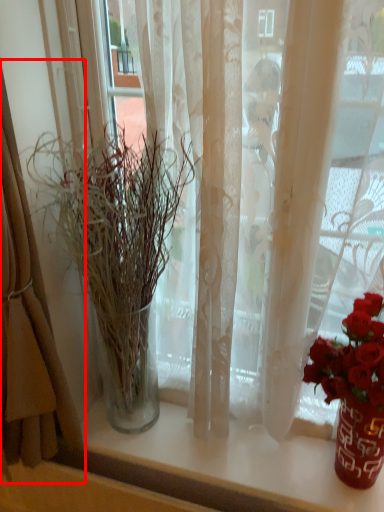
Question: From the image, what is the correct spatial relationship of curtain (annotated by the red box) in relation to houseplant?

Choices:
 (A) left
 (B) right

Answer: (A)